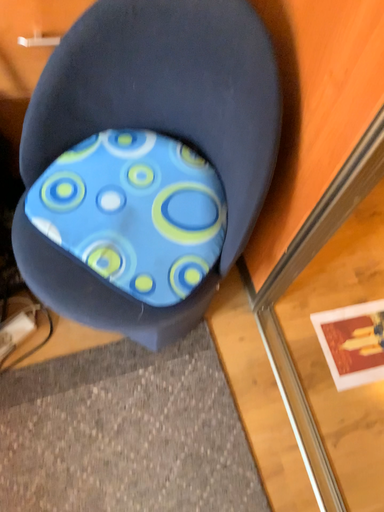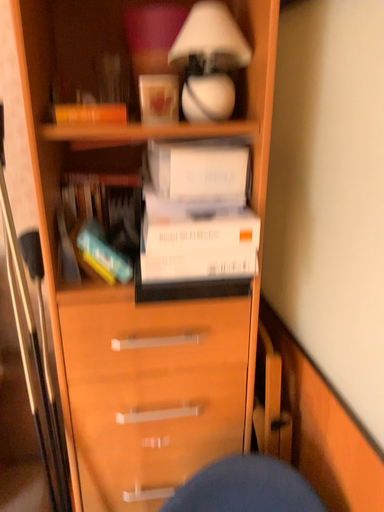
Question: Which way did the camera rotate in the video?

Choices:
 (A) rotated left
 (B) rotated right

Answer: (A)